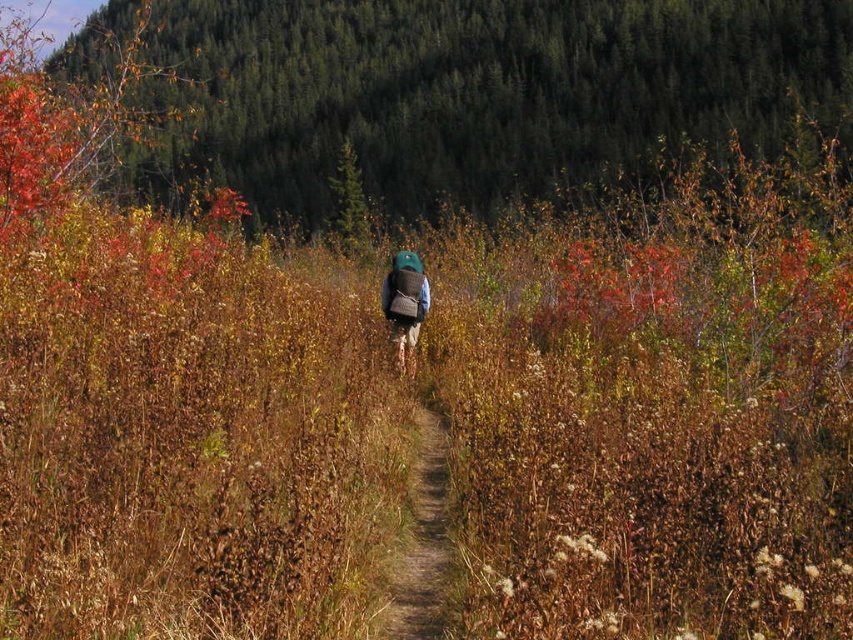
In the scene shown: You are standing at the starting point of the dirt path and want to reach the green textured foliage at upper center. Which direction should you walk to get closer to it?

The green textured foliage at upper center is located at point (x=469, y=92), so you should walk towards the upper center direction to get closer to it.

You are standing at the start of the brown dirt path at center and want to reach the green textured foliage at upper center. Which direction should you walk to get there?

The green textured foliage at upper center is to the left of the brown dirt path at center, so you should walk to the left to reach it.